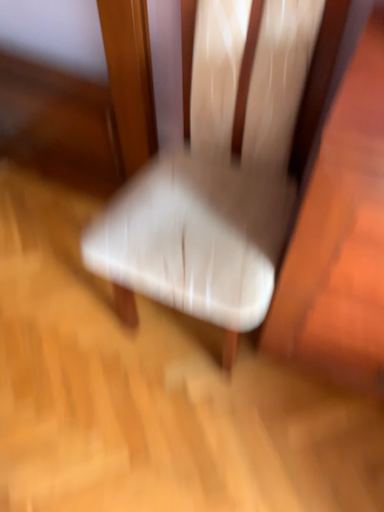
In order to click on white fabric chair at center in this screenshot , I will do `click(227, 187)`.

Measure the distance between point (x=270, y=298) and camera.

91.10 centimeters.

Image resolution: width=384 pixels, height=512 pixels. What do you see at coordinates (227, 187) in the screenshot?
I see `white fabric chair at center` at bounding box center [227, 187].

Where is `white fabric chair at center`? The width and height of the screenshot is (384, 512). white fabric chair at center is located at coordinates (227, 187).